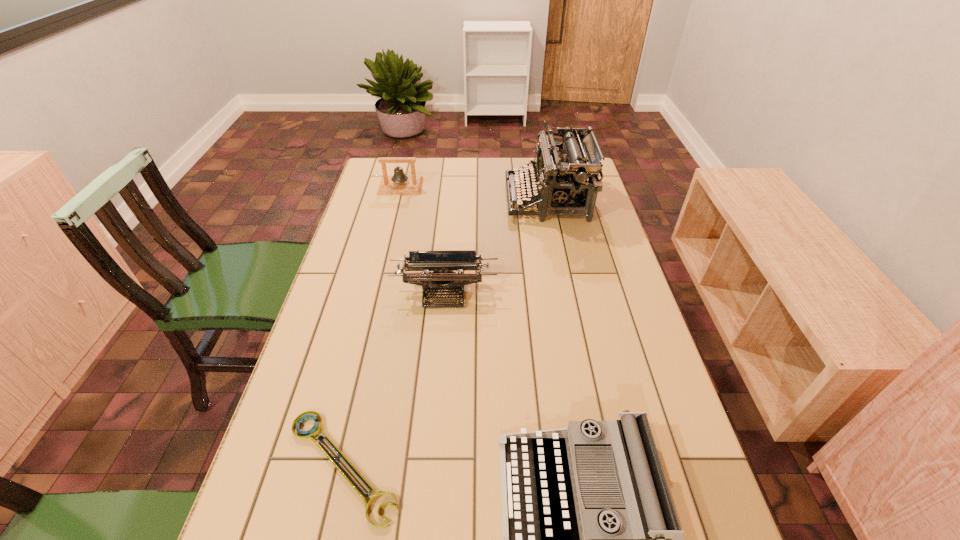
At what (x,y) coordinates should I click in order to perform the action: click on object that can be found as the second closest to the wrench. Please return your answer as a coordinate pair (x, y). The width and height of the screenshot is (960, 540). Looking at the image, I should click on tap(442, 263).

Locate which object is the third closest to the nearest typewriter. Please provide its 2D coordinates. Your answer should be formatted as a tuple, i.e. [(x, y)], where the tuple contains the x and y coordinates of a point satisfying the conditions above.

[(563, 181)]

Find the location of a particular element. Image resolution: width=960 pixels, height=540 pixels. typewriter that stands as the second closest to the bell is located at coordinates (442, 263).

Point out which typewriter is positioned as the nearest to the bell. Please provide its 2D coordinates. Your answer should be formatted as a tuple, i.e. [(x, y)], where the tuple contains the x and y coordinates of a point satisfying the conditions above.

[(563, 181)]

Locate an element on the screen. vacant space that satisfies the following two spatial constraints: 1. on the typing side of the farthest typewriter; 2. on the typing side of the second nearest typewriter is located at coordinates (566, 293).